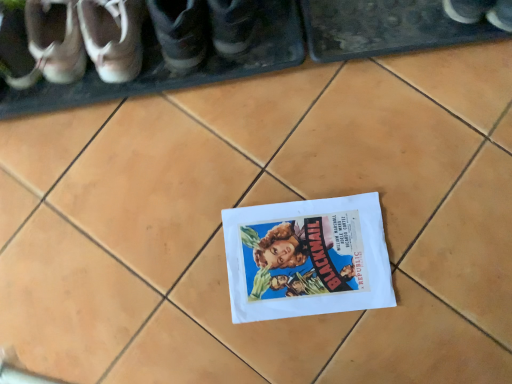
Question: Visually, is matte leather shoes at upper left, the fifth footwear positioned from the right, positioned to the left or to the right of matte brown shoe at upper left, marked as the third footwear in a left-to-right arrangement?

Choices:
 (A) right
 (B) left

Answer: (B)

Question: From a real-world perspective, relative to matte brown shoe at upper left, the fourth footwear from the right, is matte leather shoes at upper left, the fifth footwear positioned from the right, vertically above or below?

Choices:
 (A) above
 (B) below

Answer: (A)

Question: Which object is the closest to the white paper flyer at center?

Choices:
 (A) dark gray leather shoe at upper left, the 5th footwear from the left
 (B) matte brown shoe at upper left, marked as the third footwear in a left-to-right arrangement
 (C) matte leather shoes at upper left, the fifth footwear positioned from the right
 (D) matte white sneakers at upper left, arranged as the 3th footwear when viewed from the right
 (E) matte black shoe at center, the 1th footwear from the right

Answer: (D)

Question: Which object is the closest to the matte black shoe at center, the 1th footwear from the right?

Choices:
 (A) white paper flyer at center
 (B) matte white sneakers at upper left, arranged as the 3th footwear when viewed from the right
 (C) matte leather shoes at upper left, which ranks as the 2th footwear in left-to-right order
 (D) dark gray leather shoe at upper left, the 5th footwear from the left
 (E) white leather shoe at left, which ranks as the first footwear in left-to-right order

Answer: (D)